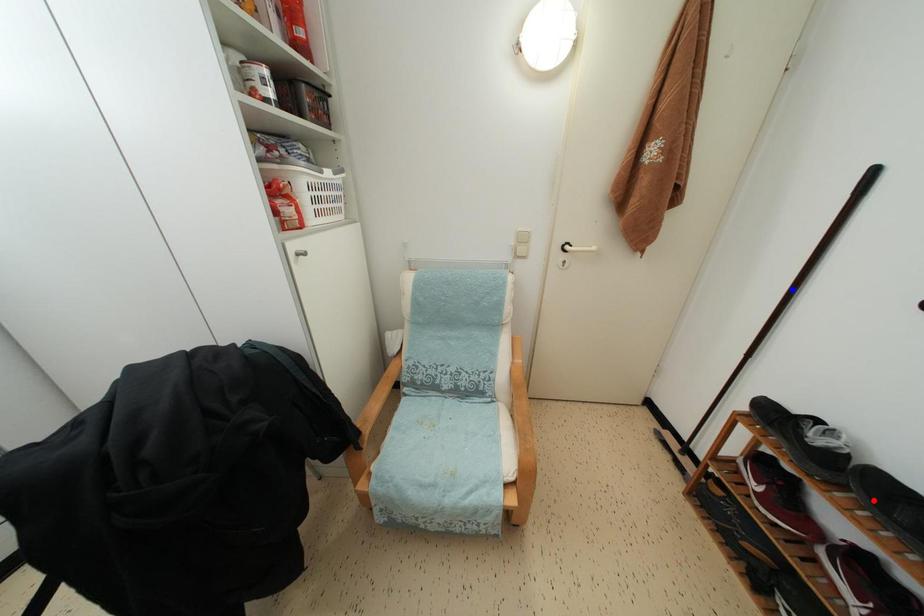
Question: Two points are marked on the image. Which point is closer to the camera?

Choices:
 (A) Blue point is closer.
 (B) Red point is closer.

Answer: (B)